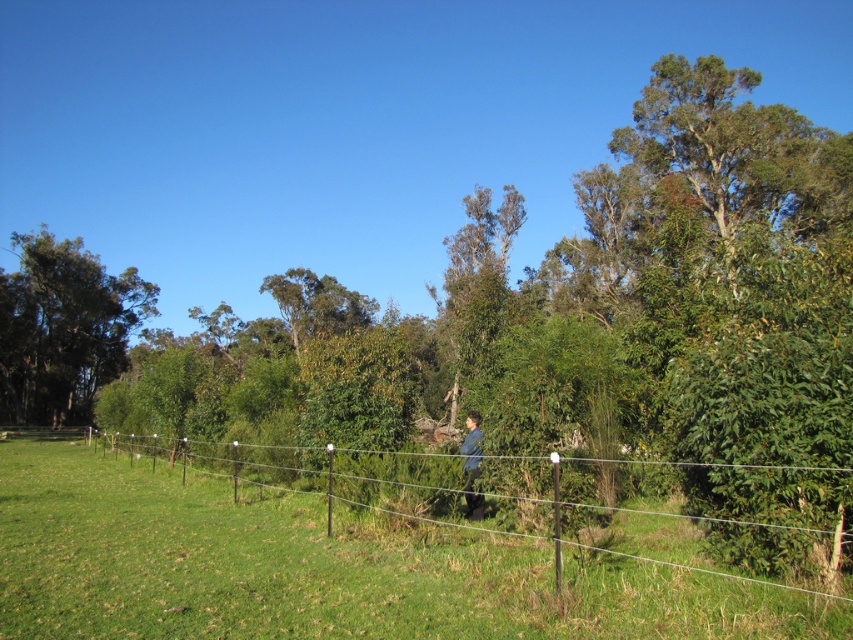
From the picture: Does green wire fence at center appear on the left side of blue denim jacket at center?

Indeed, green wire fence at center is positioned on the left side of blue denim jacket at center.

Is point (596, 628) closer to camera compared to point (474, 509)?

That is True.

Is point (584, 604) closer to viewer compared to point (471, 442)?

Yes, point (584, 604) is closer to viewer.

Find the location of a particular element. The image size is (853, 640). green wire fence at center is located at coordinates (384, 572).

Does point (57, 253) come closer to viewer compared to point (474, 426)?

No.

Based on the photo, can you confirm if green leafy tree at left is positioned above blue denim jacket at center?

Indeed, green leafy tree at left is positioned over blue denim jacket at center.

Describe the element at coordinates (62, 328) in the screenshot. I see `green leafy tree at left` at that location.

Find the location of a particular element. The image size is (853, 640). green leafy tree at left is located at coordinates (62, 328).

Can you confirm if green wire fence at center is wider than green leafy tree at left?

Yes.

Between point (370, 582) and point (38, 269), which one is positioned behind?

The point (38, 269) is more distant.

This screenshot has width=853, height=640. Find the location of `green wire fence at center`. green wire fence at center is located at coordinates (384, 572).